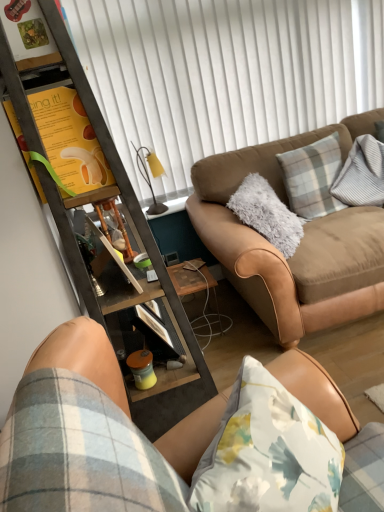
Question: Is metallic brown cabinet at left situated inside suede brown couch at center, marked as the first studio couch in a back-to-front arrangement, or outside?

Choices:
 (A) inside
 (B) outside

Answer: (B)

Question: Is metallic brown cabinet at left in front of or behind suede brown couch at center, marked as the first studio couch in a back-to-front arrangement, in the image?

Choices:
 (A) behind
 (B) front

Answer: (B)

Question: Which object is positioned farthest from the yellow paper at upper left?

Choices:
 (A) wooden side table at lower center
 (B) matte yellow cup at lower center
 (C) metallic brown cabinet at left
 (D) plaid fabric pillow at upper right
 (E) white matte shutter at upper center

Answer: (E)

Question: Estimate the real-world distances between objects in this image. Which object is closer to the suede brown couch at center, marked as the first studio couch in a back-to-front arrangement?

Choices:
 (A) yellow matte lamp at upper center
 (B) yellow paper at upper left
 (C) plaid fabric pillow at upper right
 (D) metallic brown cabinet at left
 (E) white matte shutter at upper center

Answer: (C)